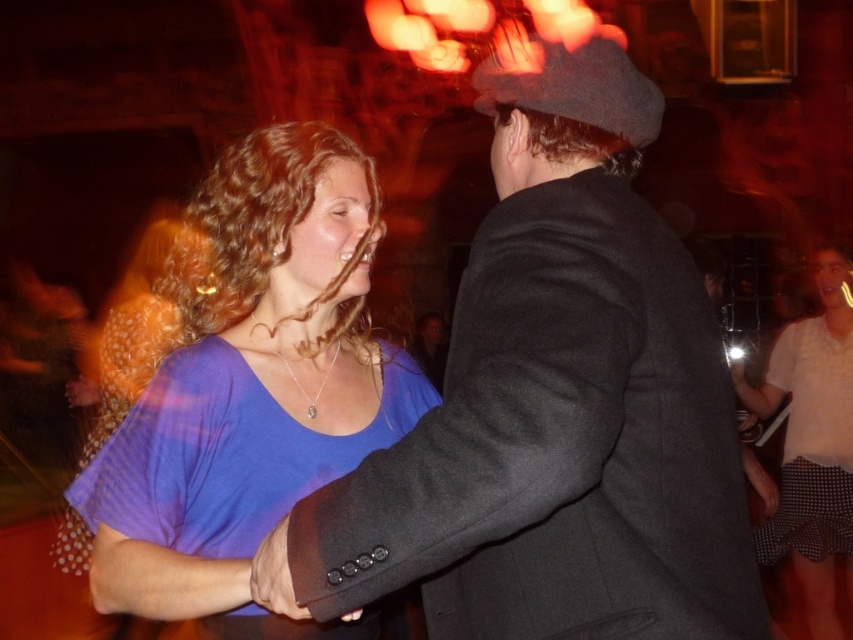
Question: Is the position of purple soft fabric blouse at center more distant than that of white dotted skirt at lower right?

Choices:
 (A) no
 (B) yes

Answer: (A)

Question: Does white dotted skirt at lower right appear over purple fabric dress at center?

Choices:
 (A) yes
 (B) no

Answer: (B)

Question: Which point is closer to the camera?

Choices:
 (A) matte black coat at center
 (B) purple soft fabric blouse at center

Answer: (A)

Question: Is matte black coat at center below white dotted skirt at lower right?

Choices:
 (A) yes
 (B) no

Answer: (B)

Question: Among these points, which one is farthest from the camera?

Choices:
 (A) (177, 416)
 (B) (596, 541)
 (C) (836, 252)

Answer: (C)

Question: Which point is farther from the camera taking this photo?

Choices:
 (A) (99, 401)
 (B) (264, 157)
 (C) (695, 474)

Answer: (A)